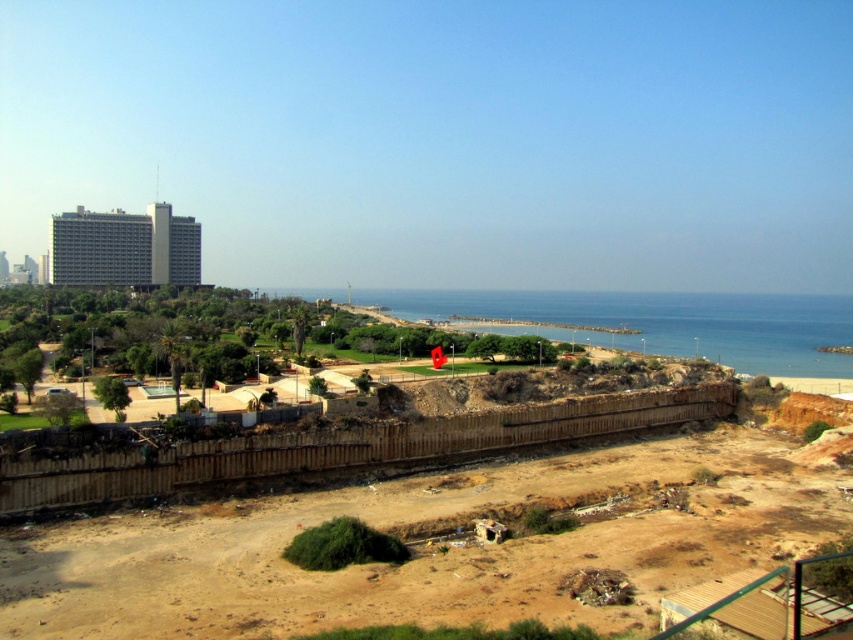
I want to click on blue water at center, so click(x=666, y=323).

The height and width of the screenshot is (640, 853). Find the location of `blue water at center`. blue water at center is located at coordinates [666, 323].